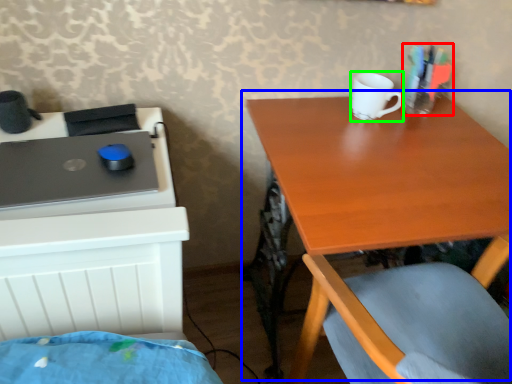
Question: Which object is positioned farthest from stationery (highlighted by a red box)? Select from table (highlighted by a blue box) and mug (highlighted by a green box).

Choices:
 (A) table
 (B) mug

Answer: (A)